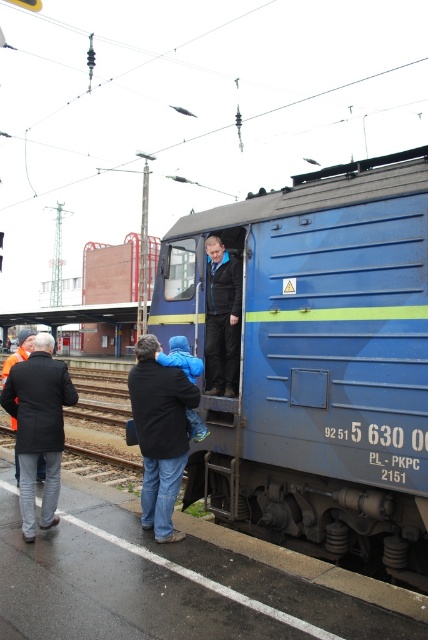
You are standing at the train station and want to reach a specific point to catch the next train. The point is located at coordinates point (137, 410). If you are currently 3 meters away from this point, how much further do you need to walk to reach it?

The distance of point (137, 410) from viewer is 4.49 meters. Since you are currently 3 meters away, you need to walk an additional 1.49 meters to reach the point.

In the scene shown: You are standing at the train station and want to take a photo of the two points mentioned. Which point, point [166,369] or point [32,477], will appear larger in your photo?

Point [166,369] is closer to the camera than point [32,477], so it will appear larger in the photo.

You are a maintenance worker needing to inspect the blue matte train at center. Your ladder is 3 meters long. If you place it against the train, will it reach the top of the train?

The distance between you and the blue matte train at center is 3.66 meters, which is greater than the ladder length of 3 meters. The ladder will not reach the train.